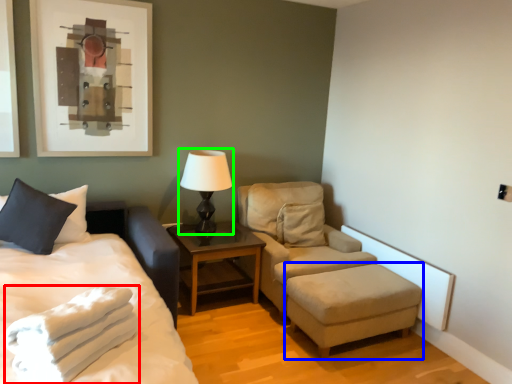
Question: Estimate the real-world distances between objects in this image. Which object is closer to blanket (highlighted by a red box), stool (highlighted by a blue box) or table lamp (highlighted by a green box)?

Choices:
 (A) stool
 (B) table lamp

Answer: (A)